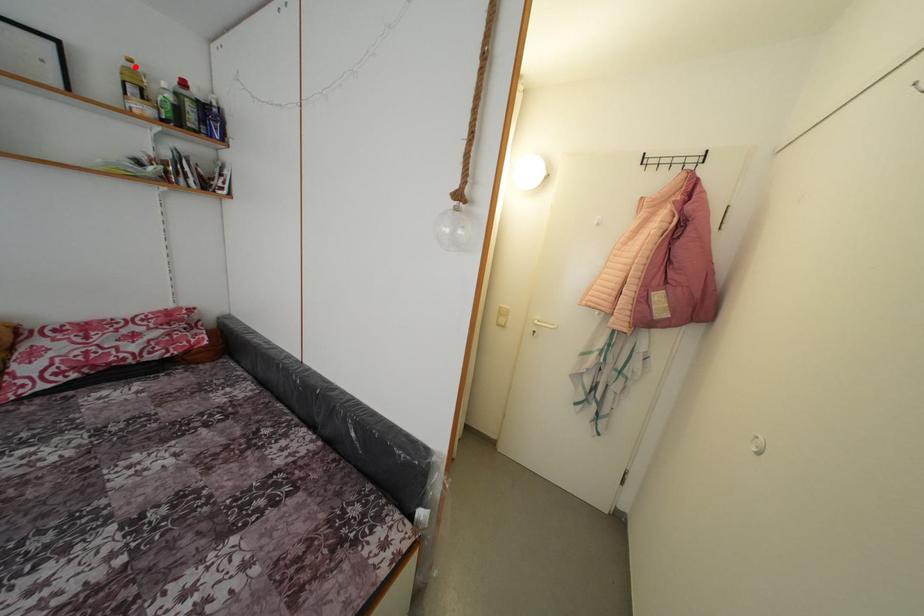
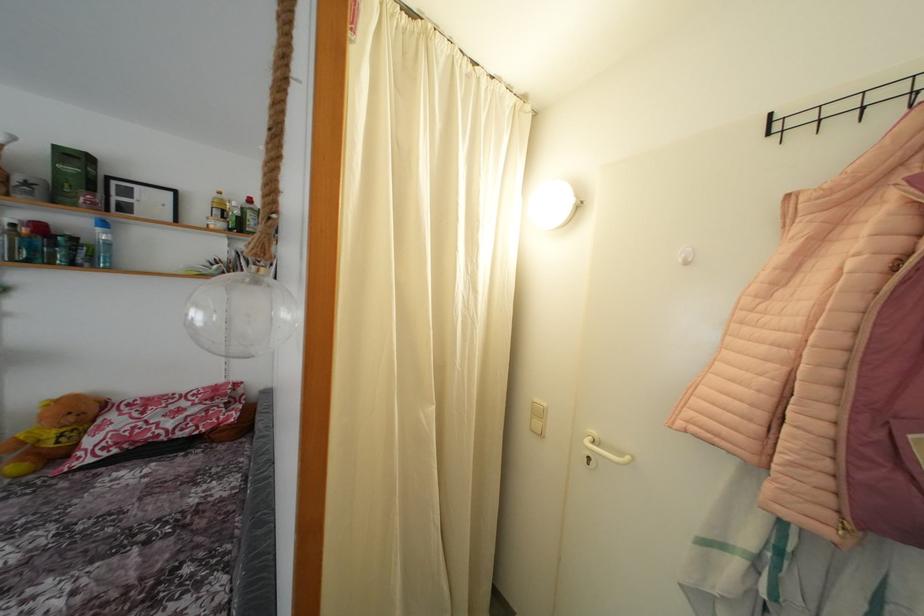
Question: I am providing you with two images of the same scene from different viewpoints. A red point is shown in image1. For the corresponding object point in image2, is it positioned nearer or farther from the camera?

Choices:
 (A) Nearer
 (B) Farther

Answer: (A)